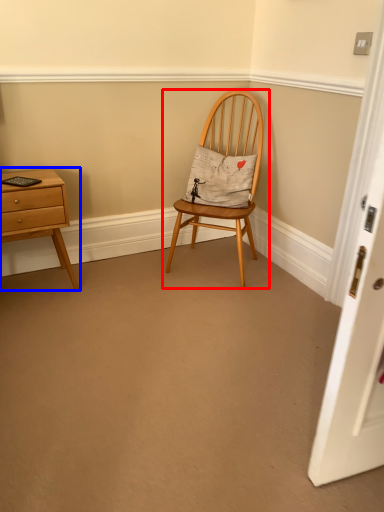
Question: Which of the following is the farthest to the observer, chair (highlighted by a red box) or nightstand (highlighted by a blue box)?

Choices:
 (A) chair
 (B) nightstand

Answer: (A)